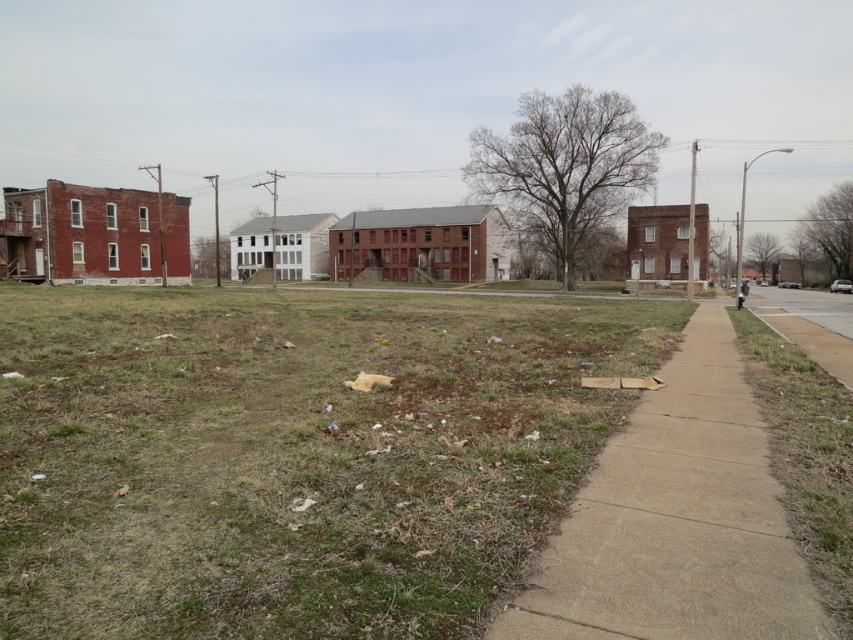
Question: Among these points, which one is farthest from the camera?

Choices:
 (A) (155, 611)
 (B) (590, 484)

Answer: (B)

Question: Does brown dry grass at lower left have a larger size compared to concrete sidewalk at lower right?

Choices:
 (A) yes
 (B) no

Answer: (A)

Question: Which of the following is the farthest from the observer?

Choices:
 (A) (486, 448)
 (B) (598, 547)

Answer: (A)

Question: Which of the following is the farthest from the observer?

Choices:
 (A) (573, 504)
 (B) (149, 452)

Answer: (B)

Question: Observing the image, what is the correct spatial positioning of brown dry grass at lower left in reference to concrete sidewalk at lower right?

Choices:
 (A) left
 (B) right

Answer: (A)

Question: Does brown dry grass at lower left appear over concrete sidewalk at lower right?

Choices:
 (A) no
 (B) yes

Answer: (B)